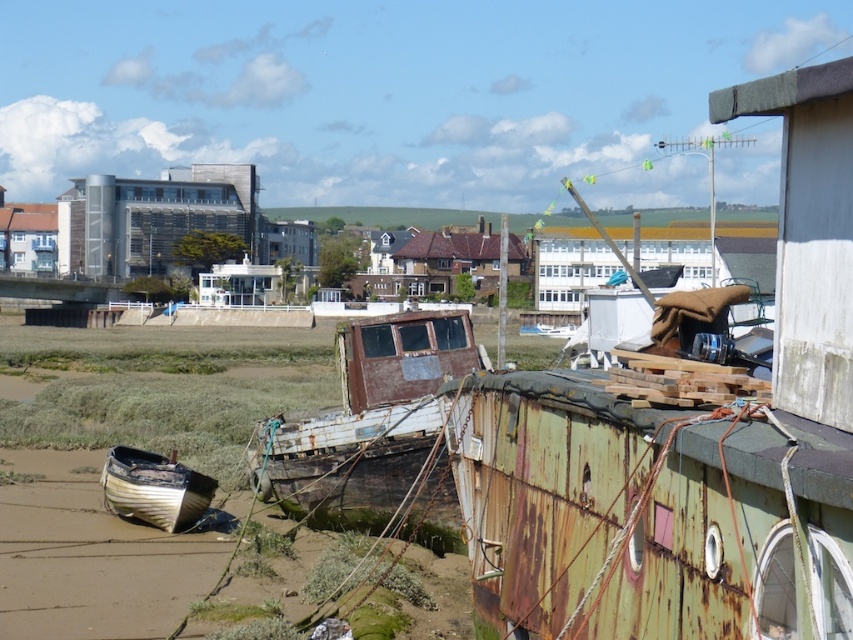
From the picture: You are standing at the edge of the shore looking towards the water. You see the smooth brown sand at lower left and the wooden boat at lower left. Which object is closer to your left side?

The smooth brown sand at lower left is closer to your left side because it is positioned to the left of the wooden boat at lower left.

You are standing at the shore and want to reach a specific point marked at coordinates point (57, 589). Given that you can walk 1.5 meters per second, how long will it take you to reach that point?

The point (57, 589) is 13.50 meters from the camera, so it will take 9 seconds to reach it since 13.50 divided by 1.5 equals 9.

Consider the image. You are standing at the point labeled as point (x=300, y=509) on the shore. A seagull is flying 18.13 meters away from you. In which direction should you look to see the seagull?

The seagull is 18.13 meters away from you at point (x=300, y=509), so you should look in the direction opposite to the shore where the abandoned boats are located.